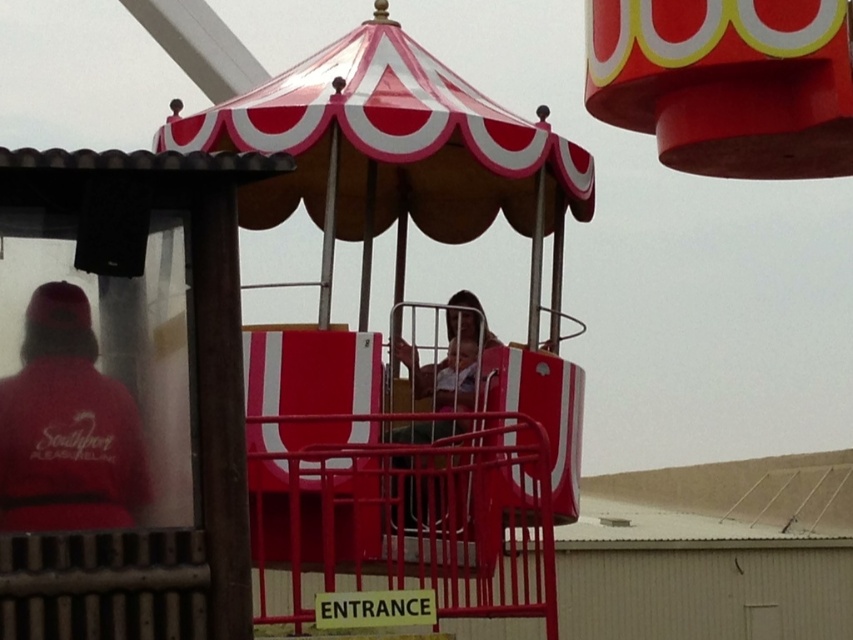
You are a visitor at the fairground and notice two items on the carousel platform. The items are the matte red cap at left and the matte plastic helmet at center. From your perspective, which item is positioned lower on the platform?

The matte red cap at left is positioned below the matte plastic helmet at center, so it is lower on the platform.

You are an event organizer checking the safety of equipment at the fairground. You notice two items on the carousel platform. Which item is wider between the matte red cap at left and the matte plastic helmet at center?

The matte red cap at left is wider than the matte plastic helmet at center according to the description.